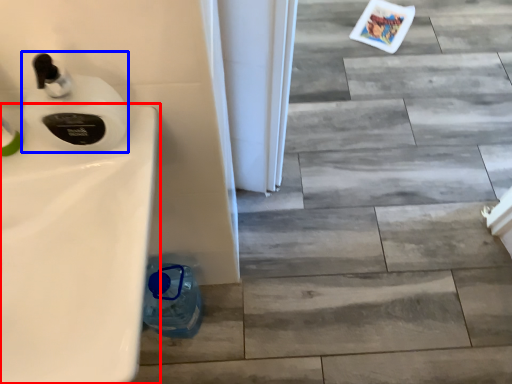
Question: Among these objects, which one is nearest to the camera, sink (highlighted by a red box) or soap dispenser (highlighted by a blue box)?

Choices:
 (A) sink
 (B) soap dispenser

Answer: (A)